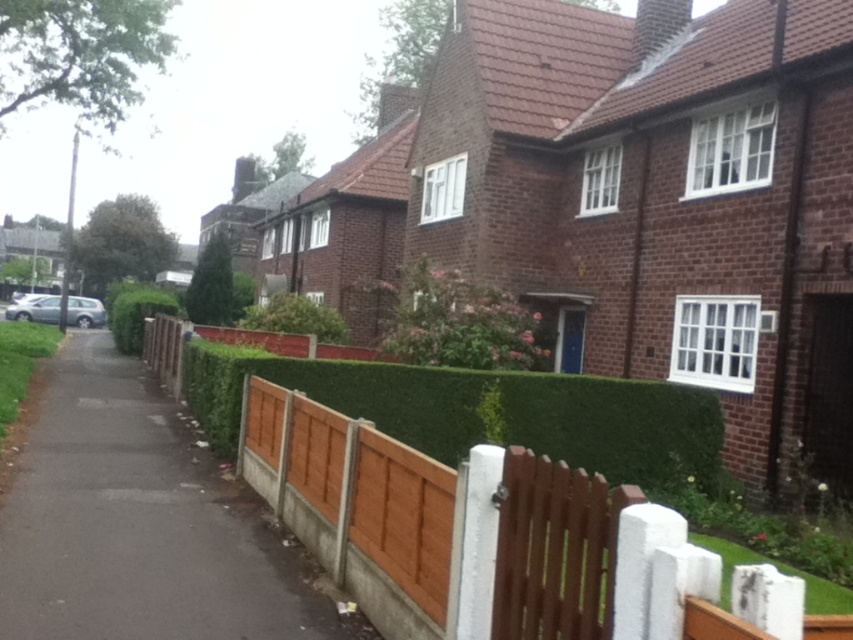
You are a painter hired to paint the brown wooden fence at center and the green hedge at center. You have a limited amount of paint. Which object requires more paint due to its size?

The brown wooden fence at center requires more paint because it is larger in size than the green hedge at center.

You are a delivery person approaching the brown wooden fence at center and the green hedge at center. Which one do you encounter first?

The brown wooden fence at center is closer to the viewer than the green hedge at center, so you will encounter the brown wooden fence at center first.